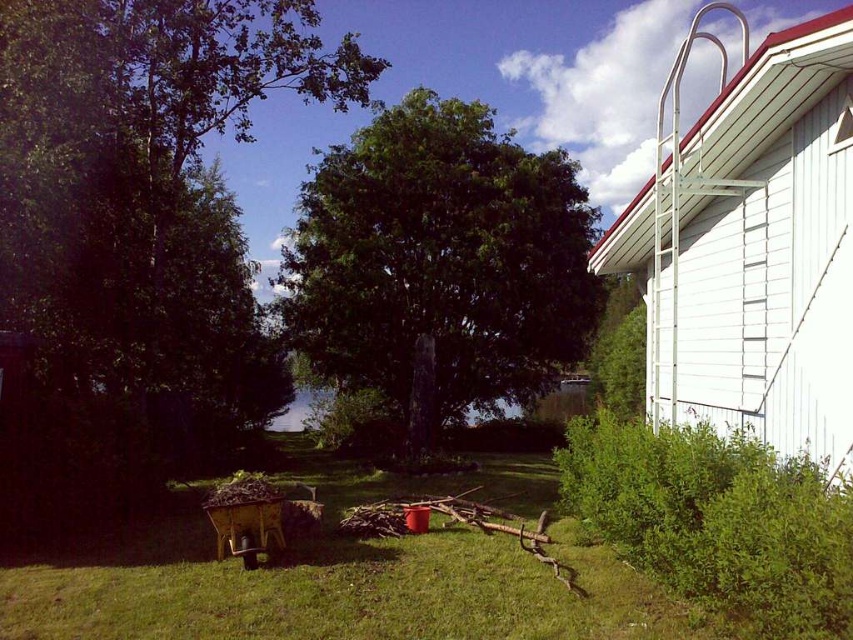
Does white wooden ladder at upper right appear under green leafy tree at center?

No, white wooden ladder at upper right is not below green leafy tree at center.

Is white wooden ladder at upper right smaller than green leafy tree at center?

No, white wooden ladder at upper right is not smaller than green leafy tree at center.

What do you see at coordinates (753, 248) in the screenshot? I see `white wooden ladder at upper right` at bounding box center [753, 248].

The height and width of the screenshot is (640, 853). What are the coordinates of `white wooden ladder at upper right` in the screenshot? It's located at (753, 248).

Which is in front, point (169, 168) or point (575, 276)?

Point (169, 168)

Does green leafy tree at left appear on the left side of green leafy tree at center?

Correct, you'll find green leafy tree at left to the left of green leafy tree at center.

In order to click on green leafy tree at left in this screenshot , I will do `click(143, 205)`.

Between green leafy tree at center and green grass at center, which one has less height?

Standing shorter between the two is green grass at center.

Can you confirm if green leafy tree at center is positioned to the left of green grass at center?

Yes, green leafy tree at center is to the left of green grass at center.

This screenshot has height=640, width=853. I want to click on green leafy tree at center, so 439,262.

At what (x,y) coordinates should I click in order to perform the action: click on green leafy tree at center. Please return your answer as a coordinate pair (x, y). The image size is (853, 640). Looking at the image, I should click on (439, 262).